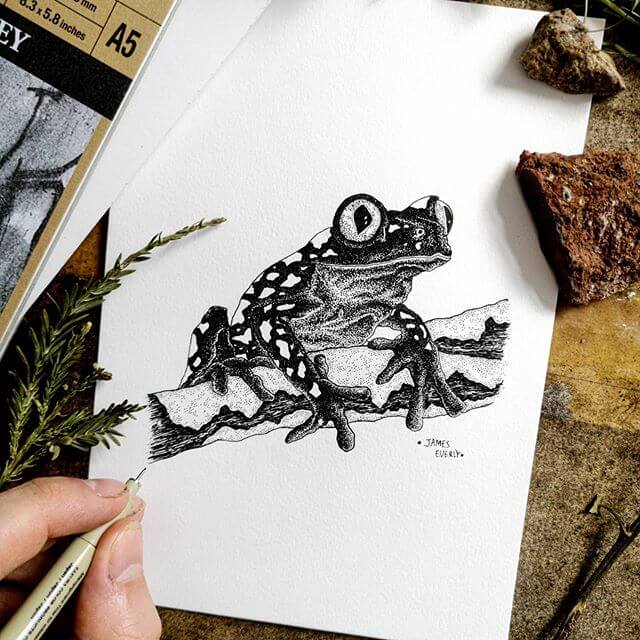
The height and width of the screenshot is (640, 640). Identify the location of picture. (364, 265).